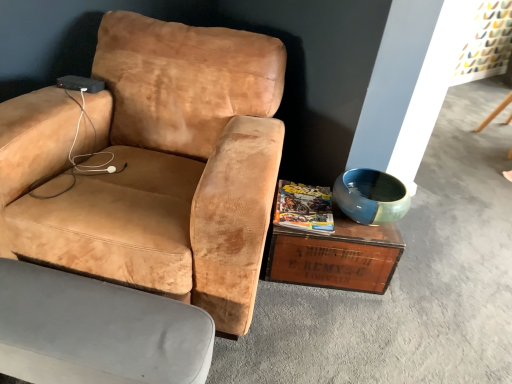
What are the coordinates of `free space between suede tan chair at center, the second chair from the bottom, and wooden crate at lower right` in the screenshot? It's located at (301, 317).